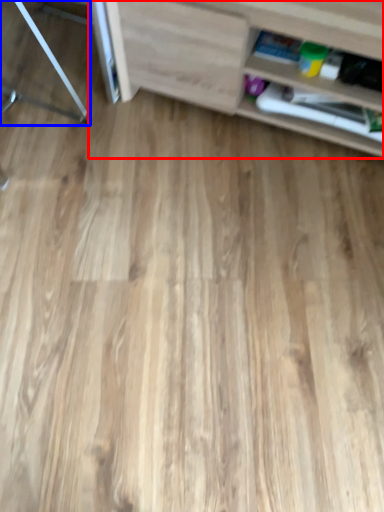
Question: Which point is closer to the camera, shelf (highlighted by a red box) or furniture (highlighted by a blue box)?

Choices:
 (A) shelf
 (B) furniture

Answer: (A)